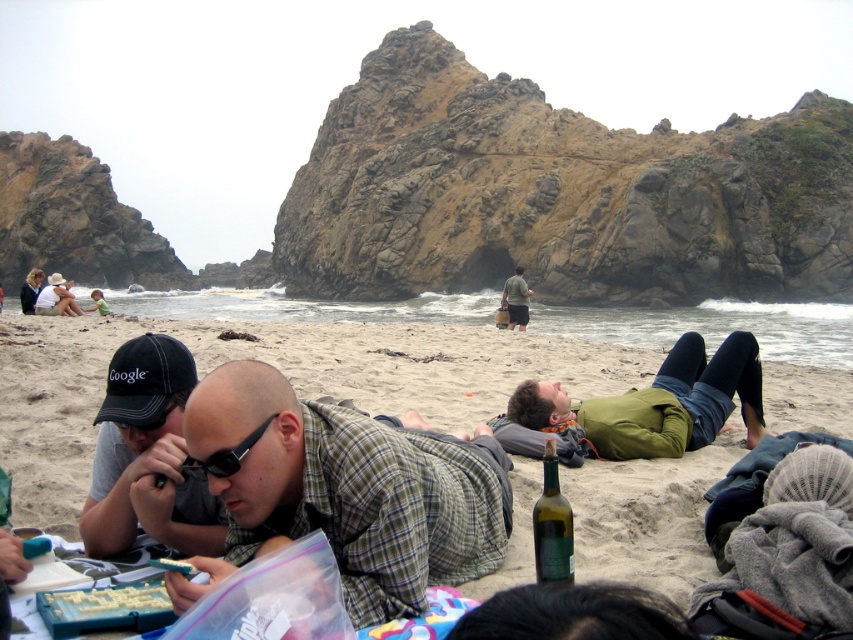
Does dark gray fabric cap at lower left appear over matte black cap at upper left?

Actually, dark gray fabric cap at lower left is below matte black cap at upper left.

Identify the location of dark gray fabric cap at lower left. The height and width of the screenshot is (640, 853). (148, 456).

Can you confirm if black plastic sunglasses at center is positioned to the left of green fabric shirt at center?

Correct, you'll find black plastic sunglasses at center to the left of green fabric shirt at center.

Does black plastic sunglasses at center have a greater height compared to green fabric shirt at center?

No.

I want to click on black plastic sunglasses at center, so click(223, 456).

Is black denim baseball cap at lower left above black plastic sunglasses at center?

Yes.

In the scene shown: Who is positioned more to the left, black denim baseball cap at lower left or black plastic sunglasses at center?

black denim baseball cap at lower left is more to the left.

Where is `black denim baseball cap at lower left`? black denim baseball cap at lower left is located at coordinates 144,378.

Identify the location of black denim baseball cap at lower left. (144, 378).